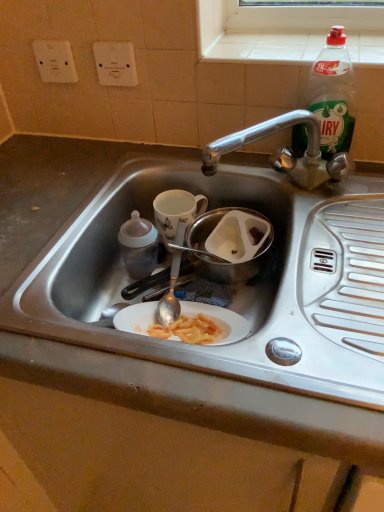
Identify the location of empty space that is ontop of white tile at upper center (from a real-world perspective). Image resolution: width=384 pixels, height=512 pixels. (294, 44).